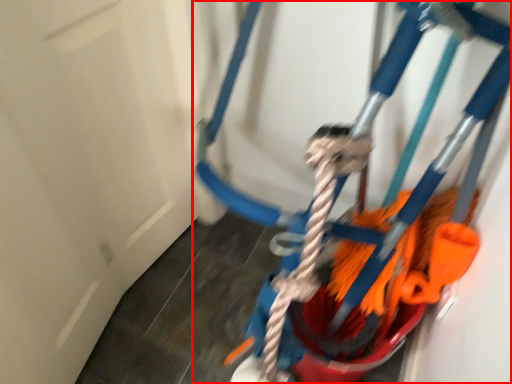
Question: Where is toy (annotated by the red box) located in relation to door in the image?

Choices:
 (A) right
 (B) left

Answer: (A)